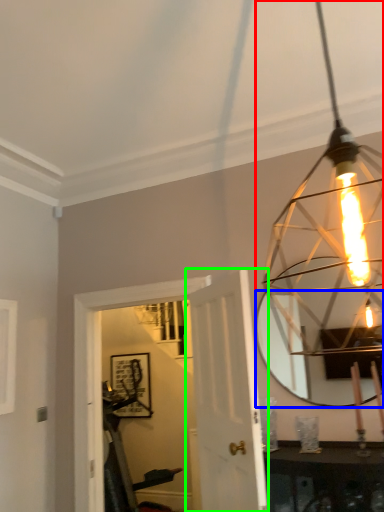
Question: Which object is the closest to the lamp (highlighted by a red box)? Choose among these: mirror (highlighted by a blue box) or door (highlighted by a green box).

Choices:
 (A) mirror
 (B) door

Answer: (A)